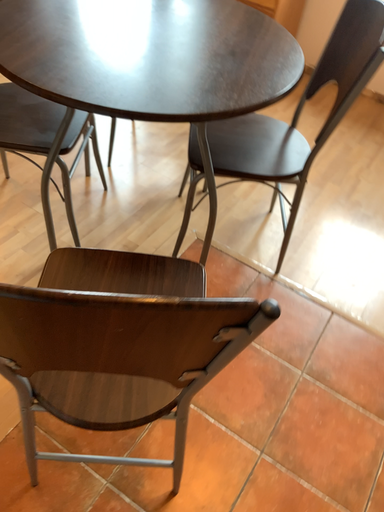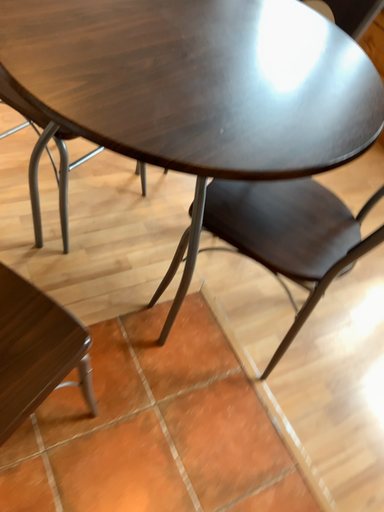
Question: How did the camera likely rotate when shooting the video?

Choices:
 (A) rotated left
 (B) rotated right

Answer: (A)